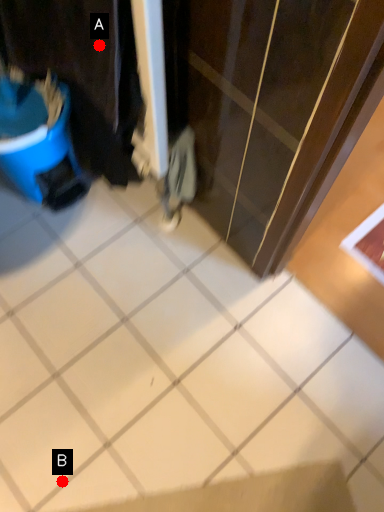
Question: Two points are circled on the image, labeled by A and B beside each circle. Which point is farther to the camera?

Choices:
 (A) A is further
 (B) B is further

Answer: (B)